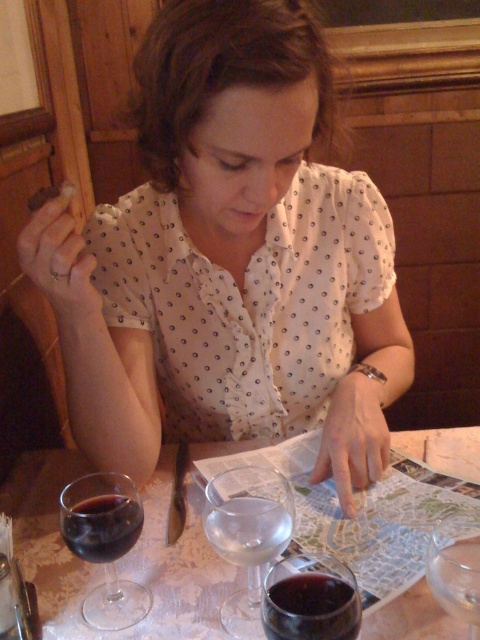
You are a waiter in a restaurant. You need to serve a customer who ordered a glass of wine. The customer prefers a taller glass. Which glass should you choose between the translucent glass wine at center and the translucent glass wine at lower left?

The translucent glass wine at lower left is taller than the translucent glass wine at center, so you should choose the translucent glass wine at lower left.

You are a waiter in a restaurant. You need to serve a customer who prefers a taller glass for their drink. Which glass should you choose between the clear glass wine glass at center and the dark red glass at lower left?

The clear glass wine glass at center is much taller than the dark red glass at lower left, so you should choose the clear glass wine glass at center.

You are a waiter in a restaurant. You need to place a dessert plate between the clear glass wine glass at center and the dark red glass at lower left. The plate has a diameter of 9 inches. Will there be enough space between them to place the dessert plate?

The distance between the clear glass wine glass at center and the dark red glass at lower left is 4.84 inches. Since the dessert plate has a diameter of 9 inches, which is larger than the available space, it won not fit. Please choose a smaller plate or rearrange the items.